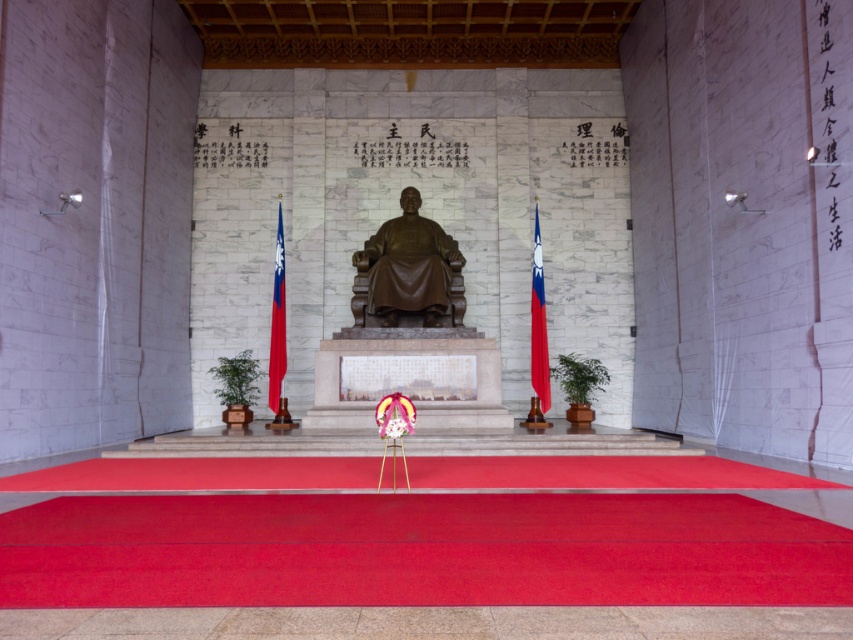
Describe the element at coordinates (408, 266) in the screenshot. I see `bronze statue at center` at that location.

Does bronze statue at center come in front of red fabric flag at center?

That is True.

Does point (427, 266) lie behind point (280, 353)?

No.

Locate an element on the screen. The image size is (853, 640). bronze statue at center is located at coordinates (408, 266).

From the picture: Which of these two, bronze statue at center or red fabric flag at right, stands shorter?

bronze statue at center

Consider the image. Does bronze statue at center have a smaller size compared to red fabric flag at right?

Actually, bronze statue at center might be larger than red fabric flag at right.

Who is more distant from viewer, (433, 262) or (543, 412)?

Positioned behind is point (433, 262).

Locate an element on the screen. The width and height of the screenshot is (853, 640). bronze statue at center is located at coordinates (408, 266).

Does red fabric flag at center have a smaller size compared to red fabric flag at right?

Actually, red fabric flag at center might be larger than red fabric flag at right.

Can you confirm if red fabric flag at center is thinner than red fabric flag at right?

In fact, red fabric flag at center might be wider than red fabric flag at right.

What do you see at coordinates (277, 326) in the screenshot? Image resolution: width=853 pixels, height=640 pixels. I see `red fabric flag at center` at bounding box center [277, 326].

Find the location of `red fabric flag at center`. red fabric flag at center is located at coordinates coord(277,326).